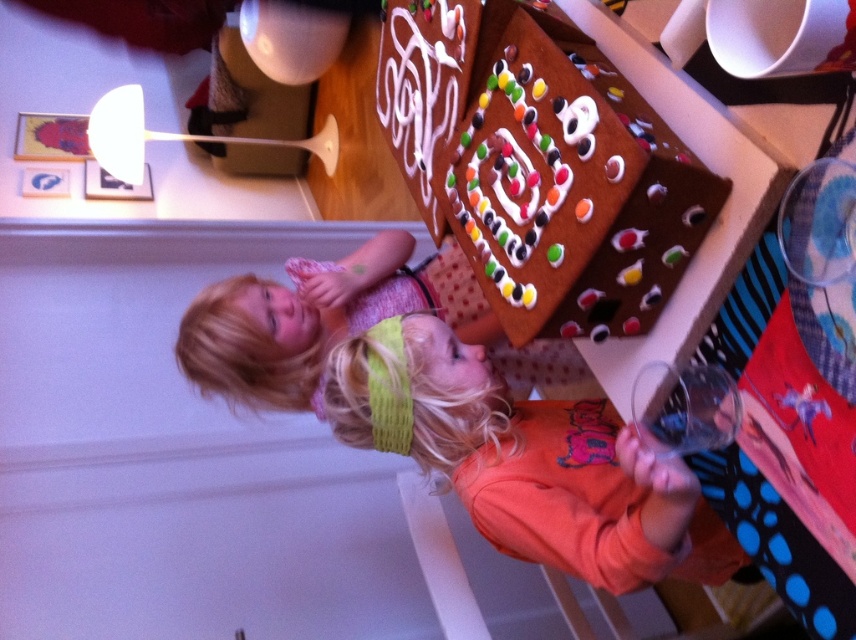
Does chocolate frosted gingerbread house at upper center appear on the left side of orange fleece sweatshirt at center?

Yes, chocolate frosted gingerbread house at upper center is to the left of orange fleece sweatshirt at center.

Which is more to the left, chocolate frosted gingerbread house at upper center or orange fleece sweatshirt at center?

Positioned to the left is chocolate frosted gingerbread house at upper center.

The width and height of the screenshot is (856, 640). I want to click on chocolate frosted gingerbread house at upper center, so click(x=539, y=164).